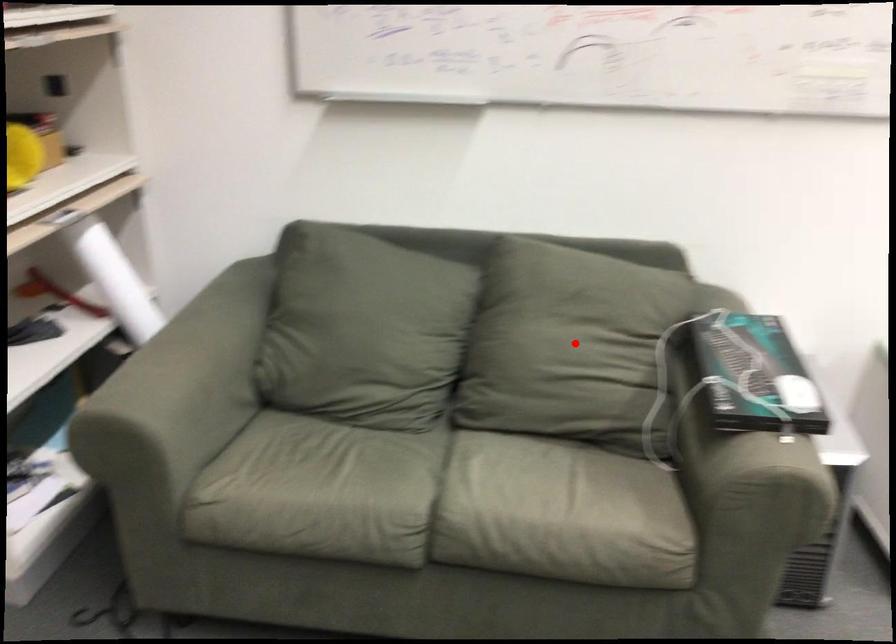
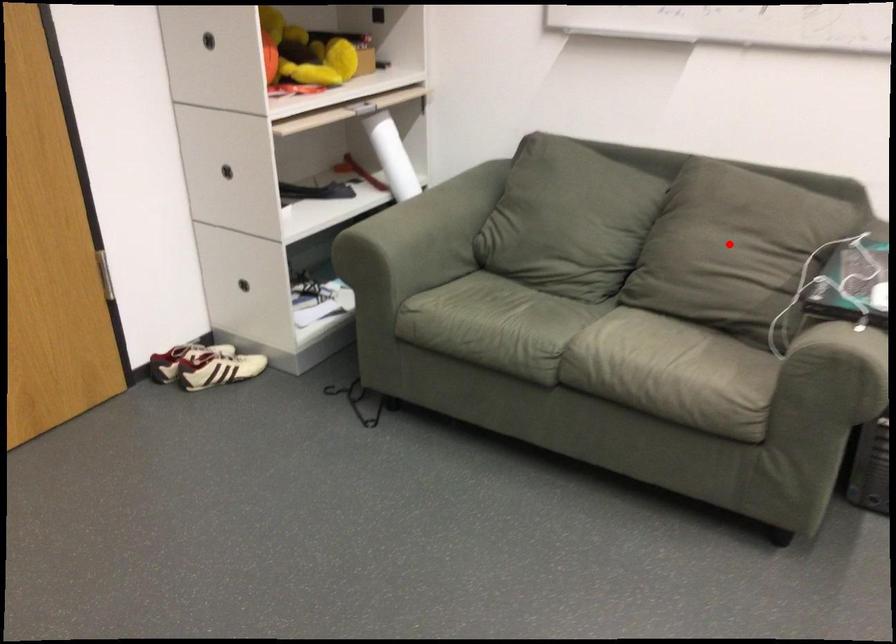
I am providing you with two images of the same scene from different viewpoints. A red point is marked on the first image and another point is marked on the second image. Are the points marked in image1 and image2 representing the same 3D position?

Yes